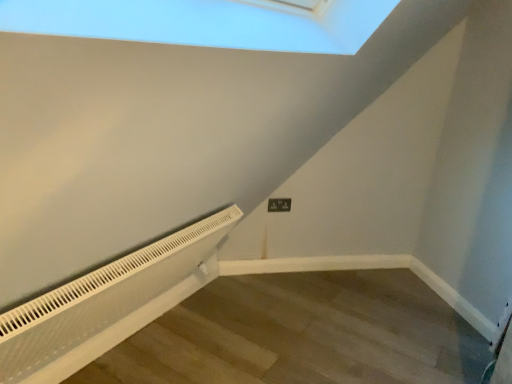
Question: Is white plastic electric outlet at center inside the boundaries of white textured radiator at lower left, or outside?

Choices:
 (A) outside
 (B) inside

Answer: (A)

Question: From their relative heights in the image, would you say white plastic electric outlet at center is taller or shorter than white textured radiator at lower left?

Choices:
 (A) short
 (B) tall

Answer: (A)

Question: Considering their positions, is white plastic electric outlet at center located in front of or behind white textured radiator at lower left?

Choices:
 (A) front
 (B) behind

Answer: (B)

Question: In terms of width, does white textured radiator at lower left look wider or thinner when compared to white plastic electric outlet at center?

Choices:
 (A) thin
 (B) wide

Answer: (B)

Question: In the image, is white textured radiator at lower left positioned in front of or behind white plastic electric outlet at center?

Choices:
 (A) front
 (B) behind

Answer: (A)

Question: From a real-world perspective, is white textured radiator at lower left physically located above or below white plastic electric outlet at center?

Choices:
 (A) below
 (B) above

Answer: (A)

Question: Considering the positions of white textured radiator at lower left and white plastic electric outlet at center in the image, is white textured radiator at lower left taller or shorter than white plastic electric outlet at center?

Choices:
 (A) tall
 (B) short

Answer: (A)